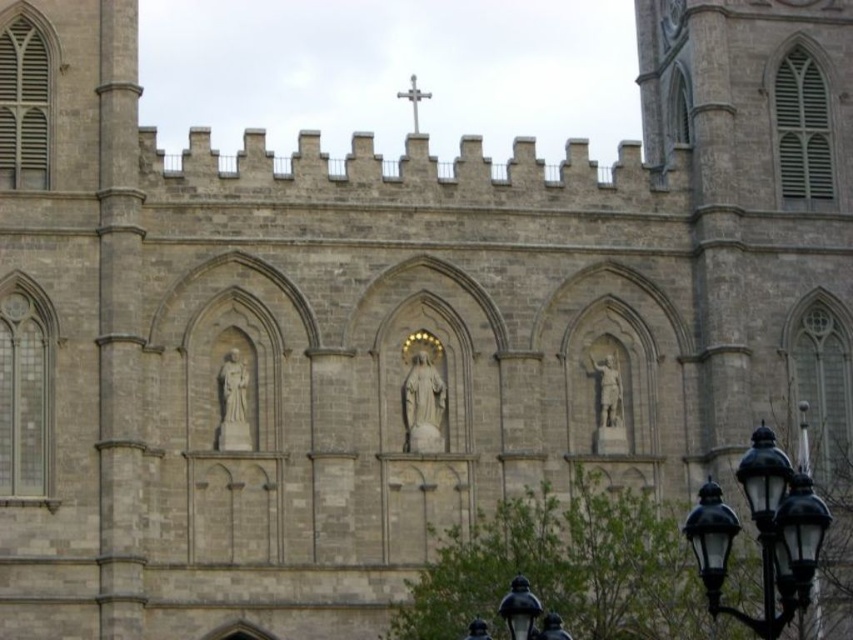
Question: Among these points, which one is nearest to the camera?

Choices:
 (A) (556, 616)
 (B) (399, 90)
 (C) (756, 515)

Answer: (C)

Question: Which object is farther from the camera taking this photo?

Choices:
 (A) silver metallic cross at upper center
 (B) black glass streetlight at lower right
 (C) black glass lamp post at lower right

Answer: (A)

Question: Is black glass streetlight at lower right below silver metallic cross at upper center?

Choices:
 (A) yes
 (B) no

Answer: (A)

Question: Which of these objects is positioned closest to the silver metallic cross at upper center?

Choices:
 (A) black glass lamp post at lower right
 (B) black glass streetlight at lower right

Answer: (B)

Question: Does black glass lamp post at lower right appear on the left side of silver metallic cross at upper center?

Choices:
 (A) yes
 (B) no

Answer: (B)

Question: Is black glass streetlight at lower right positioned at the back of silver metallic cross at upper center?

Choices:
 (A) yes
 (B) no

Answer: (B)